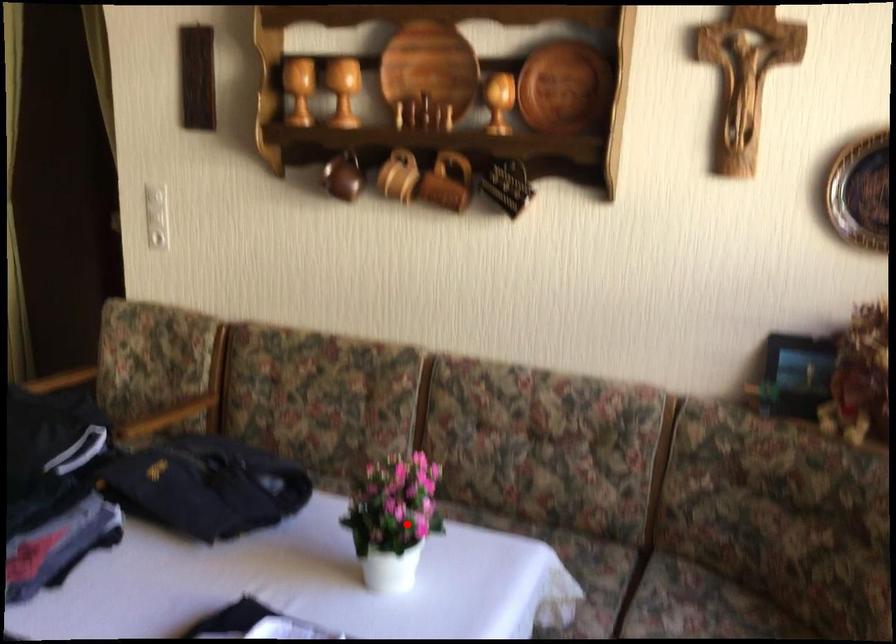
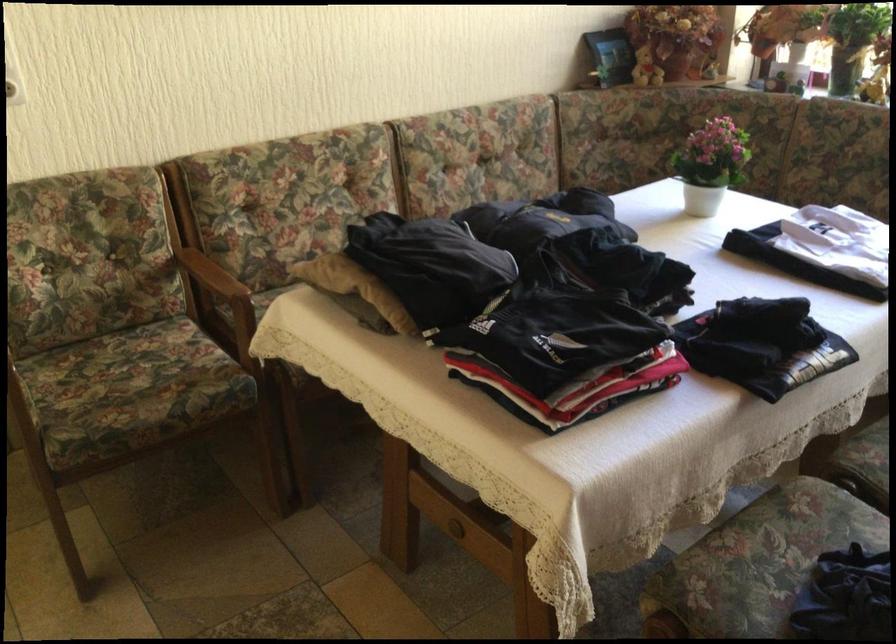
The point at the highlighted location is marked in the first image. Where is the corresponding point in the second image?

(711, 164)